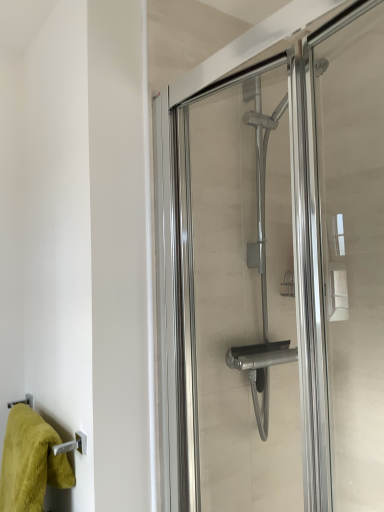
Question: Is clear glass shower door at center to the left or to the right of green fluffy towel at lower left in the image?

Choices:
 (A) right
 (B) left

Answer: (A)

Question: Considering the positions of clear glass shower door at center and green fluffy towel at lower left in the image, is clear glass shower door at center wider or thinner than green fluffy towel at lower left?

Choices:
 (A) wide
 (B) thin

Answer: (B)

Question: Looking at the image, does clear glass shower door at center seem bigger or smaller compared to green fluffy towel at lower left?

Choices:
 (A) small
 (B) big

Answer: (B)

Question: Considering the positions of green fluffy towel at lower left and clear glass shower door at center in the image, is green fluffy towel at lower left wider or thinner than clear glass shower door at center?

Choices:
 (A) thin
 (B) wide

Answer: (B)

Question: From a real-world perspective, is green fluffy towel at lower left positioned above or below clear glass shower door at center?

Choices:
 (A) below
 (B) above

Answer: (A)

Question: Considering the positions of point (74, 478) and point (228, 375), is point (74, 478) closer or farther from the camera than point (228, 375)?

Choices:
 (A) closer
 (B) farther

Answer: (A)

Question: From the image's perspective, is green fluffy towel at lower left above or below clear glass shower door at center?

Choices:
 (A) below
 (B) above

Answer: (A)